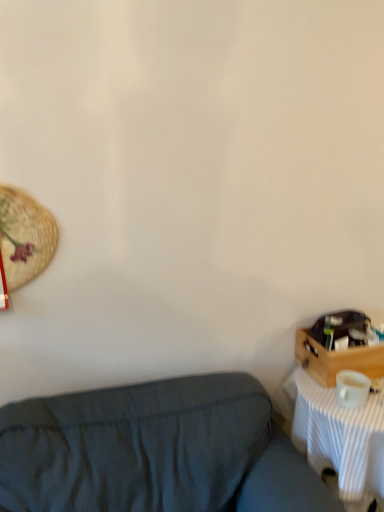
Question: From a real-world perspective, is wooden crate at right physically located above or below dark blue fabric couch at lower left?

Choices:
 (A) above
 (B) below

Answer: (A)

Question: Is point (334, 366) positioned closer to the camera than point (49, 490)?

Choices:
 (A) closer
 (B) farther

Answer: (B)

Question: Which is farther from the white matte coffee cup at right?

Choices:
 (A) white striped fabric at right
 (B) dark blue fabric couch at lower left
 (C) wooden crate at right

Answer: (B)

Question: Estimate the real-world distances between objects in this image. Which object is farther from the white matte coffee cup at right?

Choices:
 (A) white striped fabric at right
 (B) wooden crate at right
 (C) dark blue fabric couch at lower left

Answer: (C)